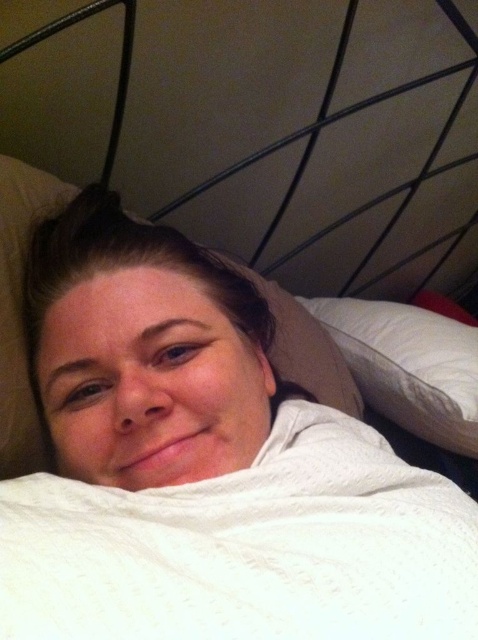
You are a photographer setting up a shot in this bedroom. You want to position a small lamp exactly 0.1 units to the right and 0.05 units above the metallic black headboard at upper center. Where should you place the lamp in terms of coordinates?

The metallic black headboard at upper center is located at coordinates (271, 129). To place the lamp 0.1 units to the right and 0.05 units above, the new coordinates would be (294, 193).

You are arranging a photo shoot in the bedroom scene. You have a camera positioned to capture the person lying in bed. The photographer wants to adjust the angle so that the metallic black headboard at upper center is visible to the right of the white soft pillow at center. Is the current arrangement already meeting this requirement?

Yes, the metallic black headboard at upper center is already positioned to the right of the white soft pillow at center, so the current arrangement meets the photographer requirement.